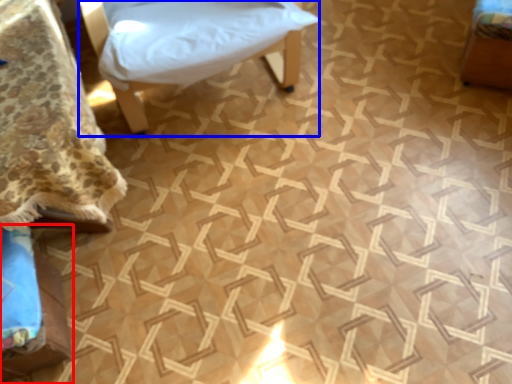
Question: Which of the following is the closest to the observer, furniture (highlighted by a red box) or furniture (highlighted by a blue box)?

Choices:
 (A) furniture
 (B) furniture

Answer: (A)